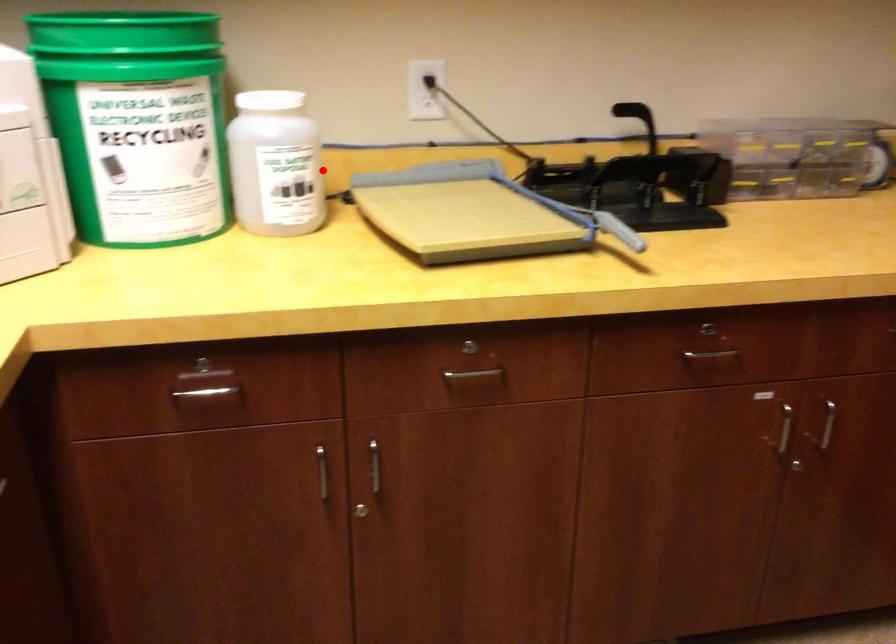
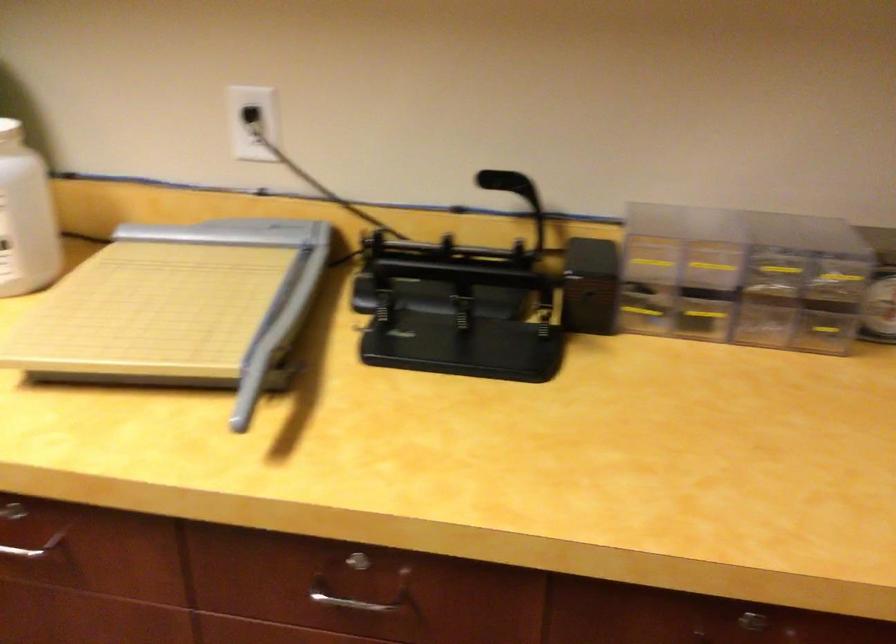
Question: I am providing you with two images of the same scene from different viewpoints. Given a red point in image1, look at the same physical point in image2. Is it:

Choices:
 (A) Closer to the viewpoint
 (B) Farther from the viewpoint

Answer: (A)